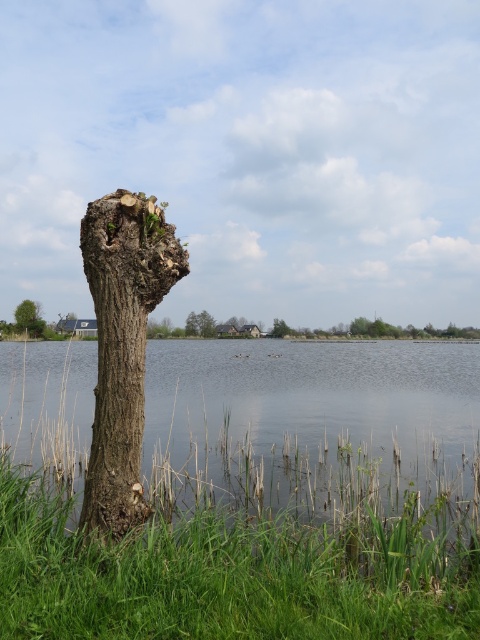
Question: Observing the image, what is the correct spatial positioning of clear water at center in reference to rough bark tree trunk at left?

Choices:
 (A) below
 (B) above

Answer: (A)

Question: Does green rough bark tree at left have a lesser width compared to smooth bark tree trunk at center?

Choices:
 (A) yes
 (B) no

Answer: (B)

Question: Which object is the farthest from the green rough bark tree at left?

Choices:
 (A) smooth bark tree trunk at center
 (B) green grass at lower left
 (C) rough bark tree trunk at left
 (D) clear water at center

Answer: (C)

Question: Which point is farther from the camera taking this photo?

Choices:
 (A) (131, 394)
 (B) (286, 324)

Answer: (B)

Question: Which point is farther to the camera?

Choices:
 (A) rough bark tree trunk at left
 (B) clear water at center
 (C) green grass at lower left
 (D) green rough bark tree at left

Answer: (D)

Question: Can you confirm if rough bark tree trunk at left is wider than green rough bark tree at left?

Choices:
 (A) no
 (B) yes

Answer: (A)